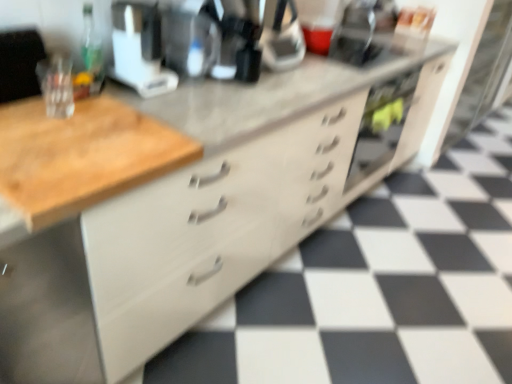
Question: From their relative heights in the image, would you say white plastic coffee maker at upper center is taller or shorter than green glass bottle at upper left?

Choices:
 (A) short
 (B) tall

Answer: (B)

Question: From a real-world perspective, relative to green glass bottle at upper left, is white plastic coffee maker at upper center vertically above or below?

Choices:
 (A) above
 (B) below

Answer: (A)

Question: Estimate the real-world distances between objects in this image. Which object is closer to the green glass bottle at upper left?

Choices:
 (A) black plastic coffee machine at center
 (B) white plastic coffee maker at upper center

Answer: (B)

Question: Which object is positioned closest to the white plastic coffee maker at upper center?

Choices:
 (A) green glass bottle at upper left
 (B) black plastic coffee machine at center

Answer: (A)